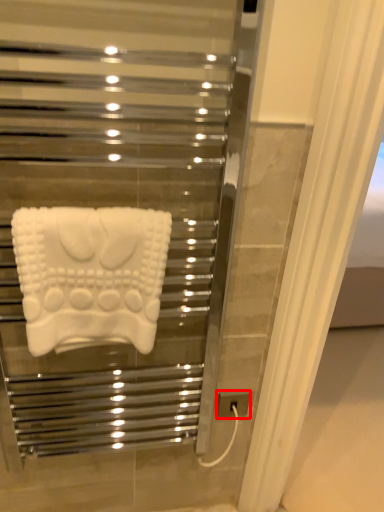
Question: Considering the relative positions of electric outlet (annotated by the red box) and towel in the image provided, where is electric outlet (annotated by the red box) located with respect to the staircase?

Choices:
 (A) right
 (B) left

Answer: (A)